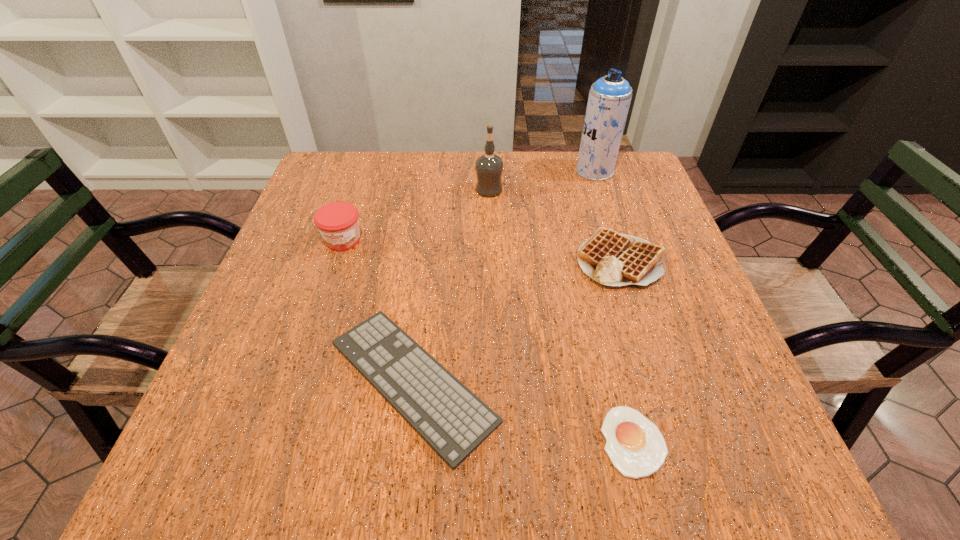
This screenshot has height=540, width=960. In order to click on vacant area that satisfies the following two spatial constraints: 1. on the front label of the fifth shortest object; 2. on the label side of the third tallest object in this screenshot , I will do `click(491, 240)`.

Image resolution: width=960 pixels, height=540 pixels. I want to click on vacant space that satisfies the following two spatial constraints: 1. on the front label of the fifth nearest object; 2. on the right side of the waffle, so click(x=491, y=259).

In order to click on vacant space that satisfies the following two spatial constraints: 1. on the front label of the fourth tallest object; 2. on the left side of the vodka in this screenshot , I will do `click(491, 259)`.